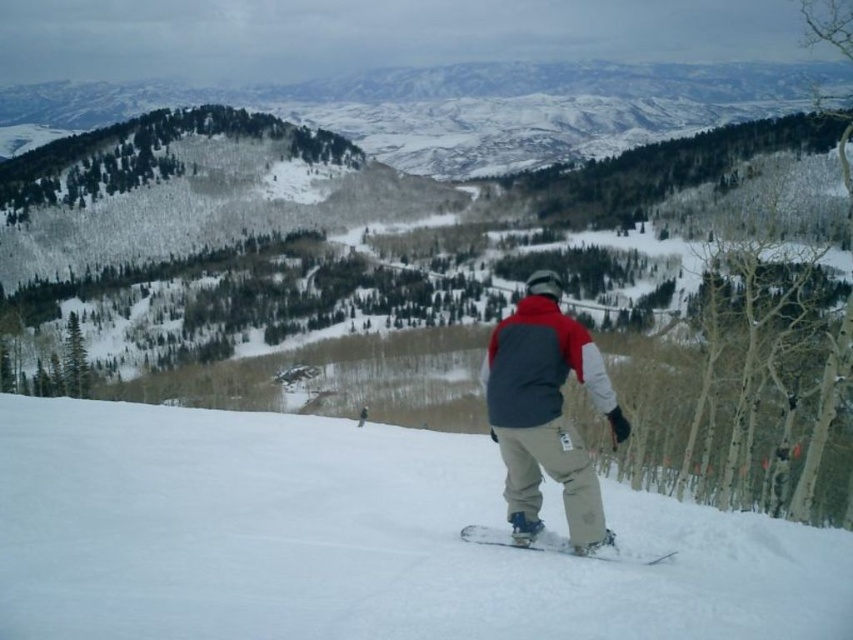
Does white snowboard at center lie behind gray fleece jacket at center?

No, white snowboard at center is in front of gray fleece jacket at center.

Does white snowboard at center appear under gray fleece jacket at center?

Yes.

Which is in front, point (485, 516) or point (564, 346)?

Point (564, 346) is more forward.

Locate an element on the screen. white snowboard at center is located at coordinates (357, 540).

Is white snowboard at center taller than white matte snowboard at center?

Correct, white snowboard at center is much taller as white matte snowboard at center.

Who is more distant from viewer, (294, 620) or (537, 541)?

Point (537, 541)

Which is behind, point (373, 605) or point (569, 545)?

The point (569, 545) is behind.

Image resolution: width=853 pixels, height=640 pixels. I want to click on white snowboard at center, so click(x=357, y=540).

Can you confirm if gray fleece jacket at center is positioned to the left of white matte snowboard at center?

Indeed, gray fleece jacket at center is positioned on the left side of white matte snowboard at center.

Is the position of gray fleece jacket at center less distant than that of white matte snowboard at center?

No, it is behind white matte snowboard at center.

What do you see at coordinates (546, 413) in the screenshot? Image resolution: width=853 pixels, height=640 pixels. I see `gray fleece jacket at center` at bounding box center [546, 413].

Where is `gray fleece jacket at center`? gray fleece jacket at center is located at coordinates (546, 413).